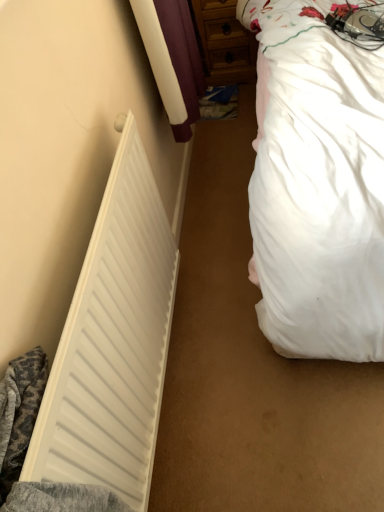
Question: Can we say white soft bed at right lies outside wooden dresser at upper center?

Choices:
 (A) yes
 (B) no

Answer: (A)

Question: Does white soft bed at right lie behind wooden dresser at upper center?

Choices:
 (A) no
 (B) yes

Answer: (A)

Question: Does white soft bed at right appear on the right side of wooden dresser at upper center?

Choices:
 (A) yes
 (B) no

Answer: (A)

Question: Does white soft bed at right have a smaller size compared to wooden dresser at upper center?

Choices:
 (A) no
 (B) yes

Answer: (A)

Question: Is white soft bed at right to the left of wooden dresser at upper center from the viewer's perspective?

Choices:
 (A) yes
 (B) no

Answer: (B)

Question: From the image's perspective, is white soft bed at right above or below white matte radiator at left?

Choices:
 (A) above
 (B) below

Answer: (A)

Question: Considering the positions of white soft bed at right and white matte radiator at left in the image, is white soft bed at right wider or thinner than white matte radiator at left?

Choices:
 (A) thin
 (B) wide

Answer: (B)

Question: Considering the positions of white soft bed at right and white matte radiator at left in the image, is white soft bed at right taller or shorter than white matte radiator at left?

Choices:
 (A) short
 (B) tall

Answer: (B)

Question: In terms of size, does white soft bed at right appear bigger or smaller than white matte radiator at left?

Choices:
 (A) small
 (B) big

Answer: (B)

Question: Considering the positions of white soft bed at right and wooden dresser at upper center in the image, is white soft bed at right wider or thinner than wooden dresser at upper center?

Choices:
 (A) wide
 (B) thin

Answer: (A)

Question: Is white soft bed at right taller or shorter than wooden dresser at upper center?

Choices:
 (A) short
 (B) tall

Answer: (B)

Question: From the image's perspective, is white soft bed at right located above or below wooden dresser at upper center?

Choices:
 (A) above
 (B) below

Answer: (B)

Question: Is white soft bed at right inside or outside of wooden dresser at upper center?

Choices:
 (A) inside
 (B) outside

Answer: (B)

Question: Does point (127, 462) appear closer or farther from the camera than point (226, 50)?

Choices:
 (A) closer
 (B) farther

Answer: (A)

Question: From a real-world perspective, relative to wooden dresser at upper center, is white matte radiator at left vertically above or below?

Choices:
 (A) below
 (B) above

Answer: (B)